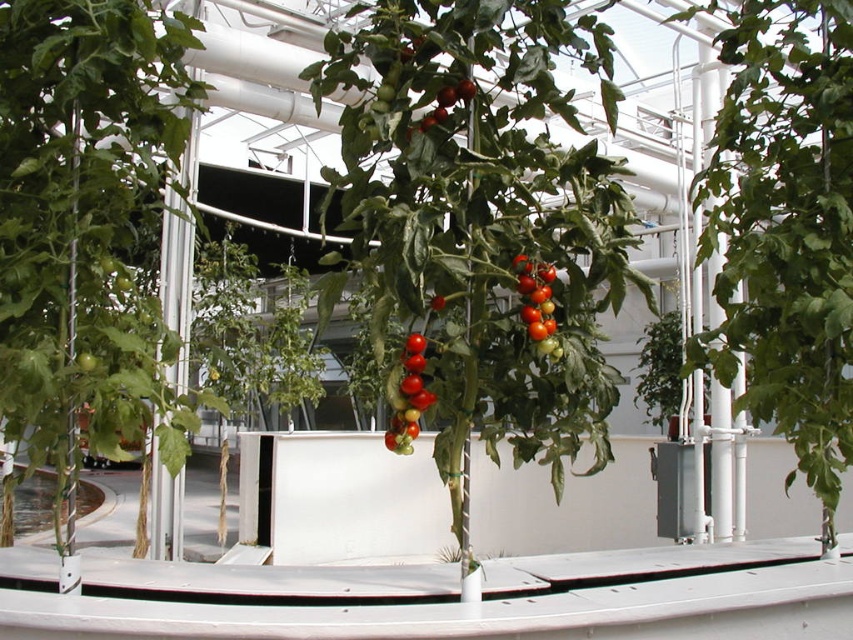
You are a gardener in the greenhouse and need to check the height of the plants. Which object is taller between the green matte plant at center and the glossy red tomatoes at center?

The green matte plant at center is taller than the glossy red tomatoes at center.

You are a gardener who needs to reach both the green matte plant at center and the glossy red tomatoes at center. Given that your arm can only extend 1.5 meters, can you reach both without moving your position?

Result: The green matte plant at center and glossy red tomatoes at center are 6.22 meters apart from each other. Since your arm can only extend 1.5 meters, you cannot reach both without moving your position because the distance between them exceeds your arm length.

You are a gardener in the greenhouse and need to determine which plant requires more support due to its size. Based on the green matte plant at left and the green matte leafy plant at center, which one is thinner and thus might need additional structural support?

The green matte plant at left is thinner than the green matte leafy plant at center, so it might need additional structural support to maintain its structure.